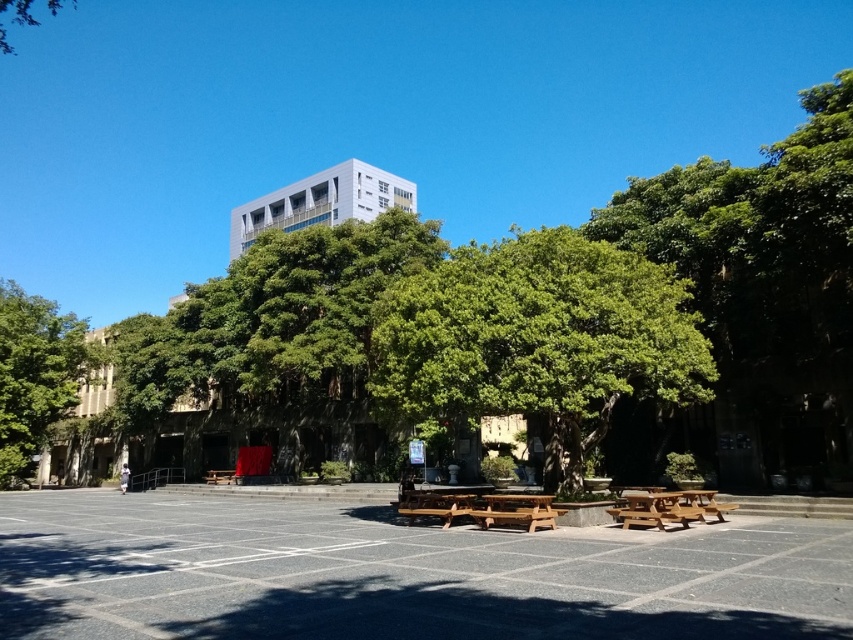
Does point (541, 513) lie behind point (422, 496)?

No, (541, 513) is closer to viewer.

Is point (538, 520) more distant than point (396, 502)?

That is False.

Where is `wooden park bench at center`? wooden park bench at center is located at coordinates (515, 509).

Does wooden picnic table at center have a lesser width compared to green leafy tree at upper left?

Yes, wooden picnic table at center is thinner than green leafy tree at upper left.

Is point (697, 504) behind point (6, 33)?

No, it is in front of (6, 33).

This screenshot has width=853, height=640. In order to click on wooden picnic table at center in this screenshot , I will do `click(668, 508)`.

From the picture: Is green leafy tree at center shorter than wooden picnic table at center?

No, green leafy tree at center is not shorter than wooden picnic table at center.

Can you confirm if green leafy tree at center is bigger than wooden picnic table at center?

Yes.

Who is more forward, (526,410) or (676,515)?

Point (526,410) is in front.

Locate an element on the screen. The width and height of the screenshot is (853, 640). green leafy tree at center is located at coordinates (537, 340).